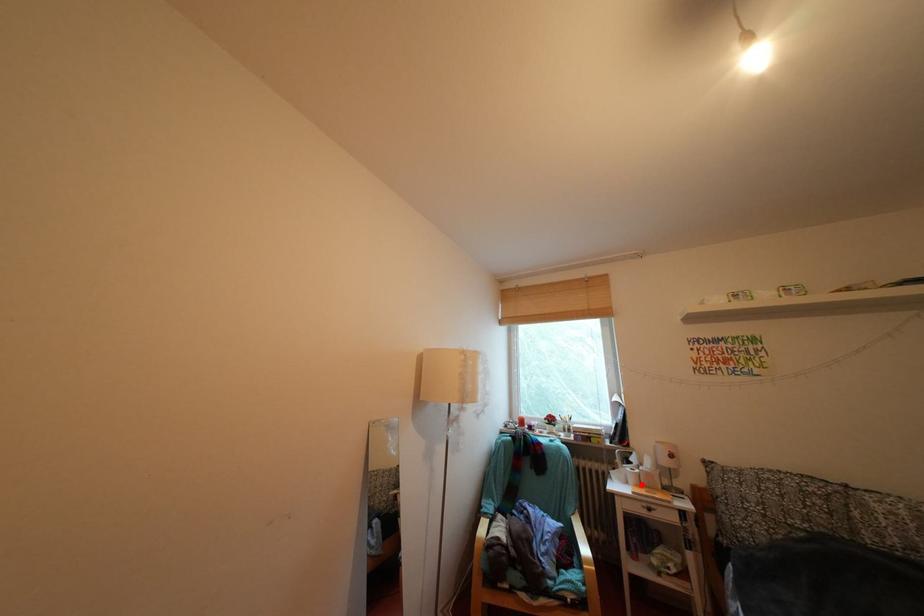
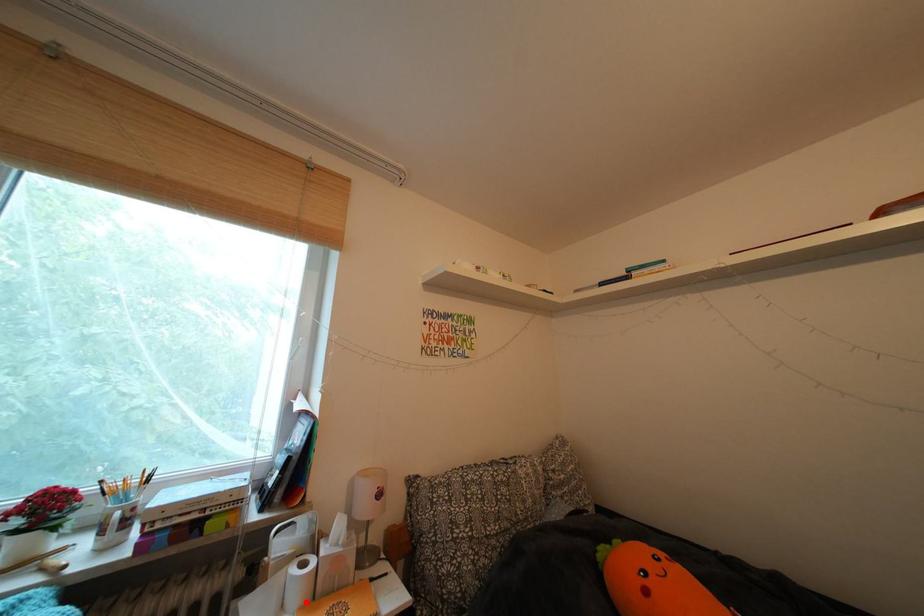
I am providing you with two images of the same scene from different viewpoints. A red point is marked on the first image and another point is marked on the second image. Does the point marked in image1 correspond to the same location as the one in image2?

Yes